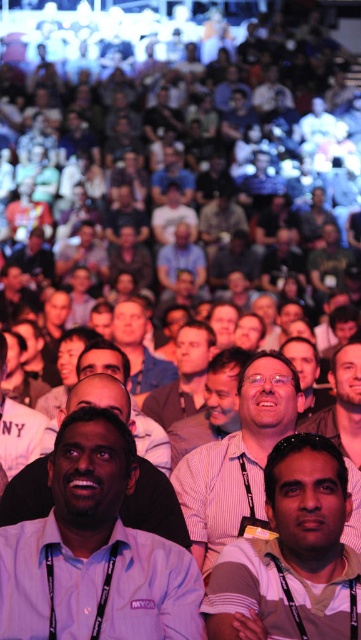
Question: Among these objects, which one is nearest to the camera?

Choices:
 (A) striped cotton shirt at center
 (B) white striped shirt at center
 (C) striped shirt at center
 (D) light brown striped shirt at center

Answer: (A)

Question: Can you confirm if striped cotton shirt at center is bigger than striped shirt at center?

Choices:
 (A) no
 (B) yes

Answer: (A)

Question: Which object is farther from the camera taking this photo?

Choices:
 (A) light brown striped shirt at center
 (B) white striped shirt at center

Answer: (A)

Question: Which point is closer to the camera?

Choices:
 (A) matte blue shirt at center
 (B) striped cotton shirt at center
 (C) purple shirt at center
 (D) light brown striped shirt at center

Answer: (C)

Question: Does purple shirt at center have a lesser width compared to light brown striped shirt at center?

Choices:
 (A) no
 (B) yes

Answer: (A)

Question: Is striped cotton shirt at center to the right of light brown striped shirt at center from the viewer's perspective?

Choices:
 (A) yes
 (B) no

Answer: (A)